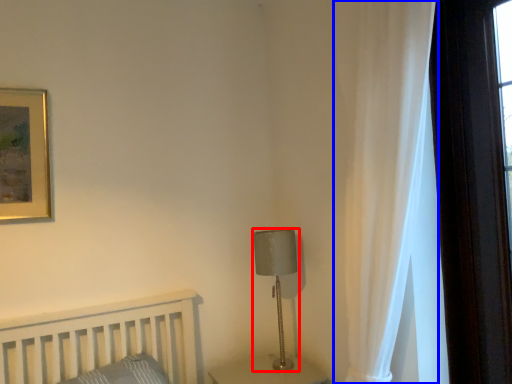
Question: Which object is further to the camera taking this photo, table lamp (highlighted by a red box) or curtain (highlighted by a blue box)?

Choices:
 (A) table lamp
 (B) curtain

Answer: (A)